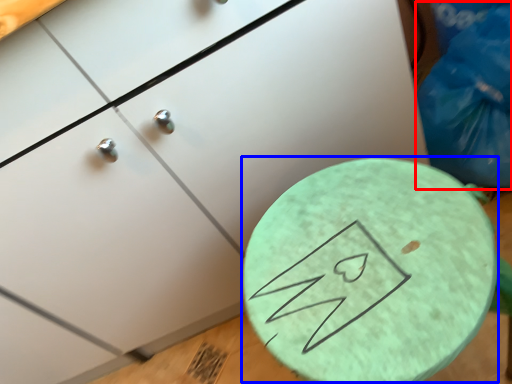
Question: Which object appears farthest to the camera in this image, garbage (highlighted by a red box) or round table (highlighted by a blue box)?

Choices:
 (A) garbage
 (B) round table

Answer: (A)